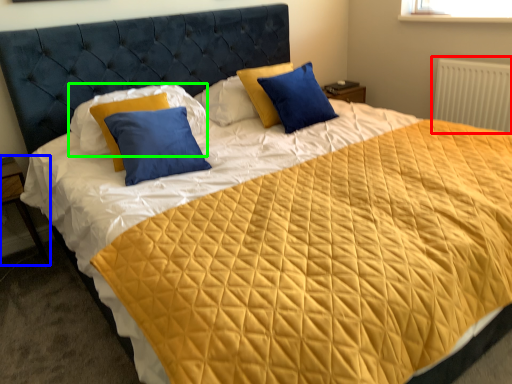
Question: Which object is the closest to the radiator (highlighted by a red box)? Choose among these: nightstand (highlighted by a blue box) or pillow (highlighted by a green box).

Choices:
 (A) nightstand
 (B) pillow

Answer: (B)